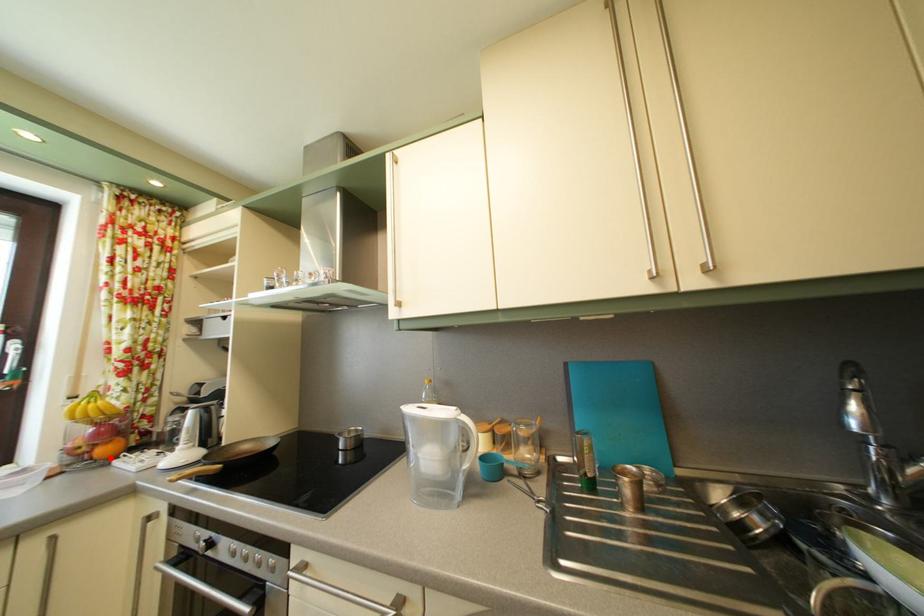
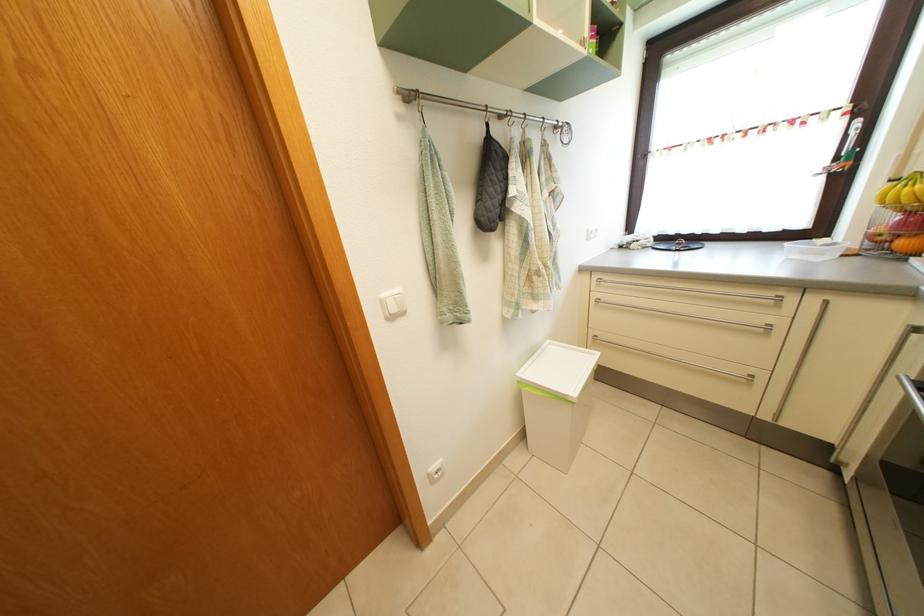
Question: I am providing you with two images of the same scene from different viewpoints. Image1 has a red point marked. In image2, the corresponding 3D location appears at what relative position? Reply with the corresponding letter.

Choices:
 (A) Closer
 (B) Farther

Answer: (B)